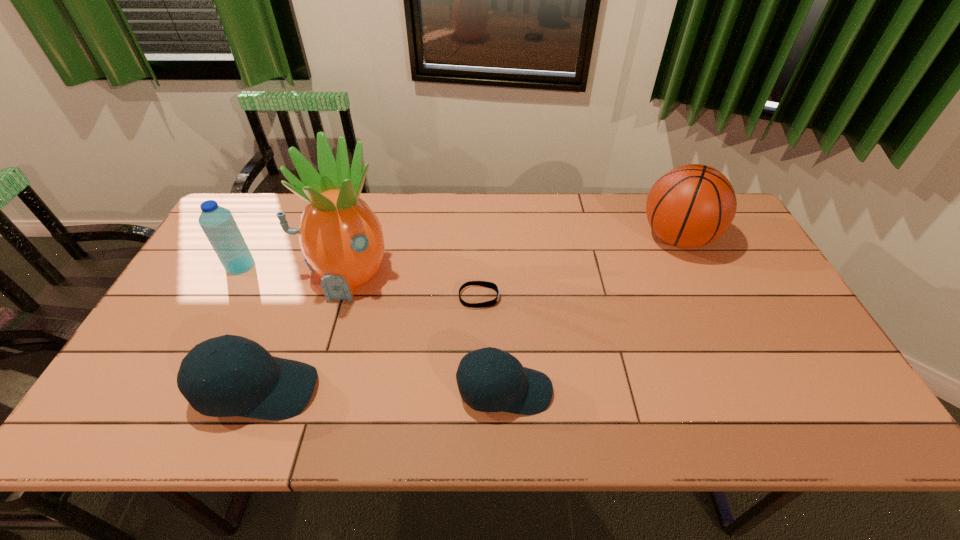
Where is `the fourth tallest object`? The height and width of the screenshot is (540, 960). the fourth tallest object is located at coordinates (265, 387).

In order to click on the taller baseball cap in this screenshot , I will do `click(265, 387)`.

Find the location of a particular element. the right baseball cap is located at coordinates (526, 391).

The image size is (960, 540). Find the location of `the second shortest object`. the second shortest object is located at coordinates (526, 391).

Identify the location of the leftmost object. (218, 224).

The width and height of the screenshot is (960, 540). What are the coordinates of `the rightmost object` in the screenshot? It's located at (692, 205).

This screenshot has height=540, width=960. I want to click on the tallest object, so click(341, 238).

Where is `the shortest object`? The height and width of the screenshot is (540, 960). the shortest object is located at coordinates (491, 285).

Identify the location of free space located on the front-facing side of the taller baseball cap. This screenshot has width=960, height=540. (417, 390).

Locate an element on the screen. free location located 0.080m on the front-facing side of the shorter baseball cap is located at coordinates (587, 391).